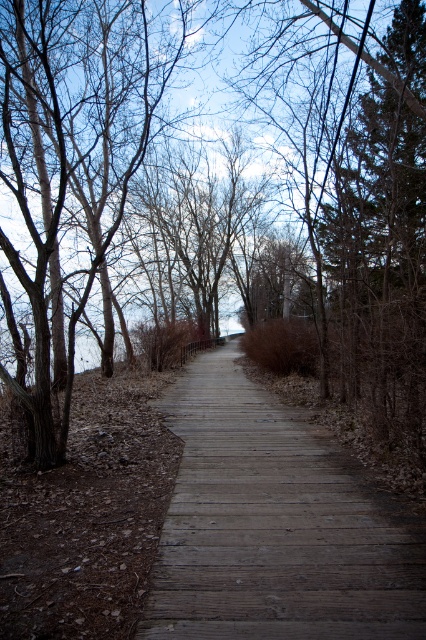
Question: Does brown wood tree at center have a larger size compared to wooden boardwalk at center?

Choices:
 (A) yes
 (B) no

Answer: (A)

Question: Which of the following is the closest to the observer?

Choices:
 (A) (78, 116)
 (B) (419, 598)

Answer: (B)

Question: Observing the image, what is the correct spatial positioning of brown wood tree at center in reference to wooden boardwalk at center?

Choices:
 (A) right
 (B) left

Answer: (B)

Question: Does brown wood tree at center come behind wooden boardwalk at center?

Choices:
 (A) yes
 (B) no

Answer: (A)

Question: Which point appears closest to the camera in this image?

Choices:
 (A) (296, 563)
 (B) (45, 346)

Answer: (A)